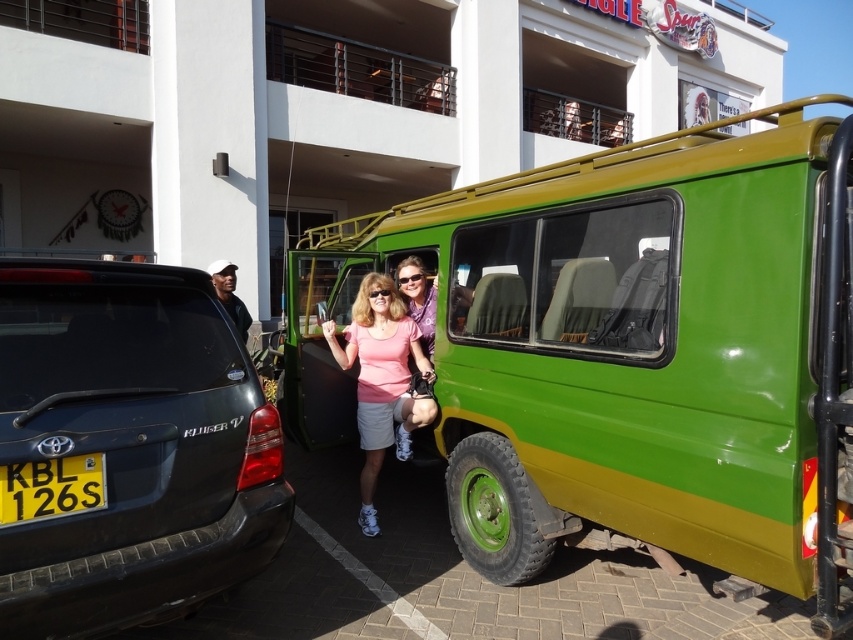
Is pink matte shirt at center smaller than black fabric cap at left?

No, pink matte shirt at center is not smaller than black fabric cap at left.

Does point (403, 380) come in front of point (247, 314)?

Yes, it is in front of point (247, 314).

Is point (376, 349) more distant than point (227, 298)?

No, it is not.

Where is `pink matte shirt at center`? The width and height of the screenshot is (853, 640). pink matte shirt at center is located at coordinates (381, 380).

Does pink matte shirt at center have a greater height compared to black plastic license plate at lower left?

Yes.

Which is more to the left, pink matte shirt at center or black plastic license plate at lower left?

Positioned to the left is black plastic license plate at lower left.

Which is in front, point (373, 400) or point (100, 474)?

Point (100, 474) is more forward.

In order to click on pink matte shirt at center in this screenshot , I will do `click(381, 380)`.

Which is more to the right, matte black suv at left or pink matte shirt at center?

Positioned to the right is pink matte shirt at center.

Is matte black suv at left positioned in front of pink matte shirt at center?

Yes, it is in front of pink matte shirt at center.

Does point (259, 404) come farther from viewer compared to point (380, 410)?

No, (259, 404) is in front of (380, 410).

The image size is (853, 640). In order to click on matte black suv at left in this screenshot , I will do `click(126, 448)`.